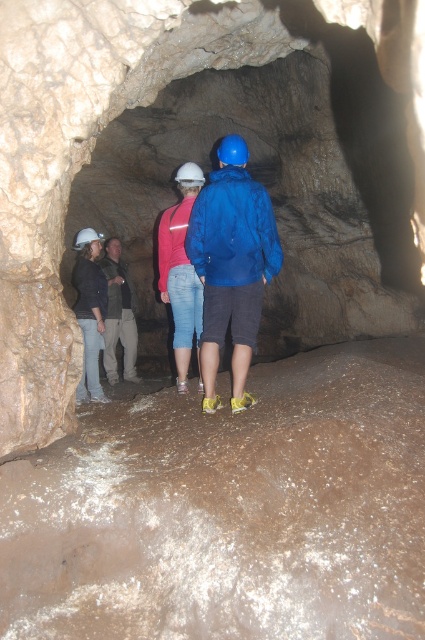
Question: Which point appears closest to the camera in this image?

Choices:
 (A) (110, 248)
 (B) (88, 232)
 (C) (82, 401)

Answer: (C)

Question: Where is blue matte jacket at center located in relation to white matte helmet at left in the image?

Choices:
 (A) below
 (B) above

Answer: (A)

Question: Which point is closer to the camera?

Choices:
 (A) (90, 237)
 (B) (220, 160)

Answer: (B)

Question: Is matte black jacket at left to the right of white matte helmet at left from the viewer's perspective?

Choices:
 (A) no
 (B) yes

Answer: (B)

Question: Is matte black jacket at left smaller than white matte helmet at left?

Choices:
 (A) no
 (B) yes

Answer: (A)

Question: Among these points, which one is farthest from the camera?

Choices:
 (A) (201, 172)
 (B) (231, 150)
 (C) (105, 401)

Answer: (C)